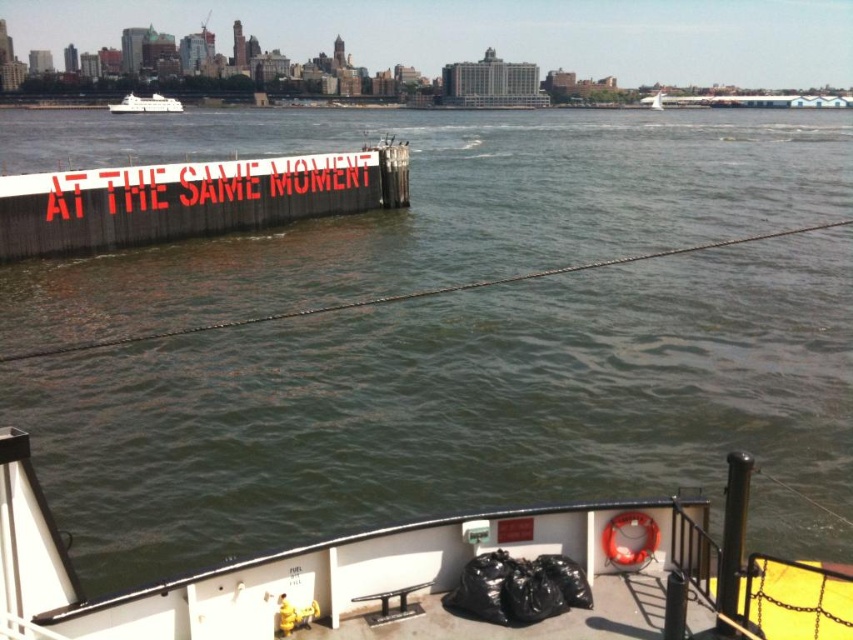
Which is in front, point (398, 182) or point (131, 93)?

Point (398, 182) is in front.

Which is behind, point (373, 176) or point (141, 108)?

Point (141, 108)

Locate an element on the screen. white painted wood sign at upper left is located at coordinates (190, 198).

Is point (683, 518) positioned before point (144, 106)?

Yes, point (683, 518) is in front of point (144, 106).

What do you see at coordinates (444, 579) in the screenshot?
I see `white matte boat at lower center` at bounding box center [444, 579].

This screenshot has height=640, width=853. What do you see at coordinates (444, 579) in the screenshot?
I see `white matte boat at lower center` at bounding box center [444, 579].

Identify the location of white matte boat at lower center. (444, 579).

Between white matte boat at lower center and white painted wood sign at upper left, which one is positioned higher?

white painted wood sign at upper left

What do you see at coordinates (444, 579) in the screenshot? This screenshot has width=853, height=640. I see `white matte boat at lower center` at bounding box center [444, 579].

Between point (779, 588) and point (323, 184), which one is positioned behind?

Point (323, 184)

Image resolution: width=853 pixels, height=640 pixels. In order to click on white matte boat at lower center in this screenshot , I will do `click(444, 579)`.